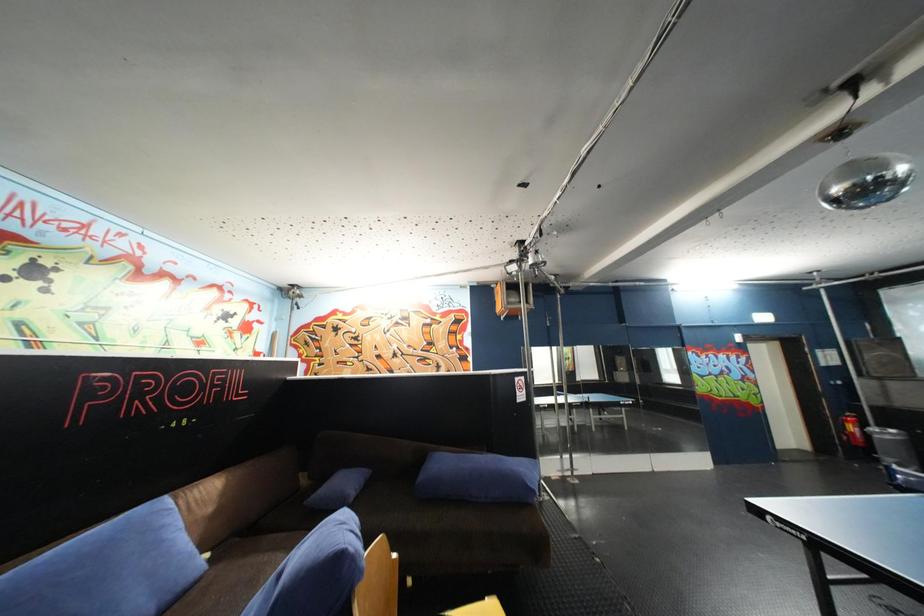
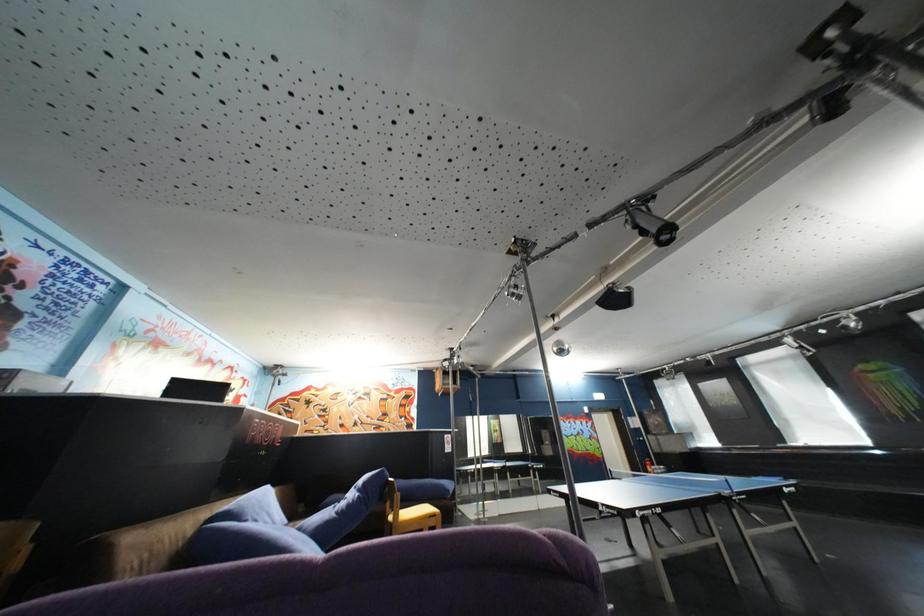
Question: In a continuous first-person perspective shot, in which direction is the camera moving?

Choices:
 (A) Left
 (B) Right
 (C) Forward
 (D) Backward

Answer: (D)